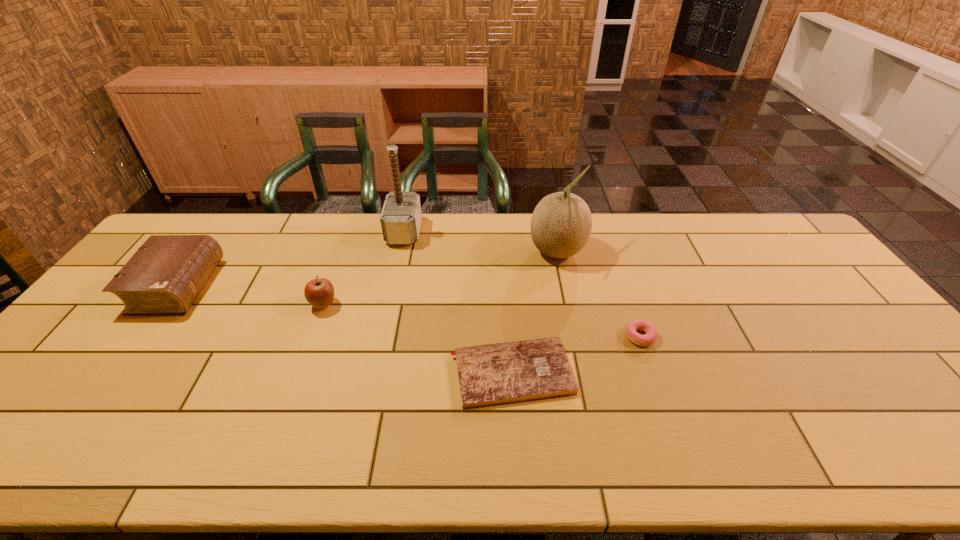
Identify the location of the tallest object. (401, 216).

At what (x,y) coordinates should I click in order to perform the action: click on hammer. Please return your answer as a coordinate pair (x, y). Looking at the image, I should click on (401, 216).

This screenshot has height=540, width=960. I want to click on the fifth shortest object, so pos(561,224).

The width and height of the screenshot is (960, 540). In order to click on the farther Bible in this screenshot , I will do `click(166, 274)`.

Locate an element on the screen. Image resolution: width=960 pixels, height=540 pixels. the taller Bible is located at coordinates (166, 274).

This screenshot has width=960, height=540. Identify the location of apple. (319, 292).

Identify the location of the rightmost object. (649, 338).

Locate an element on the screen. The image size is (960, 540). doughnut is located at coordinates (649, 338).

The width and height of the screenshot is (960, 540). I want to click on the right Bible, so click(494, 374).

This screenshot has height=540, width=960. I want to click on the nearer Bible, so click(494, 374).